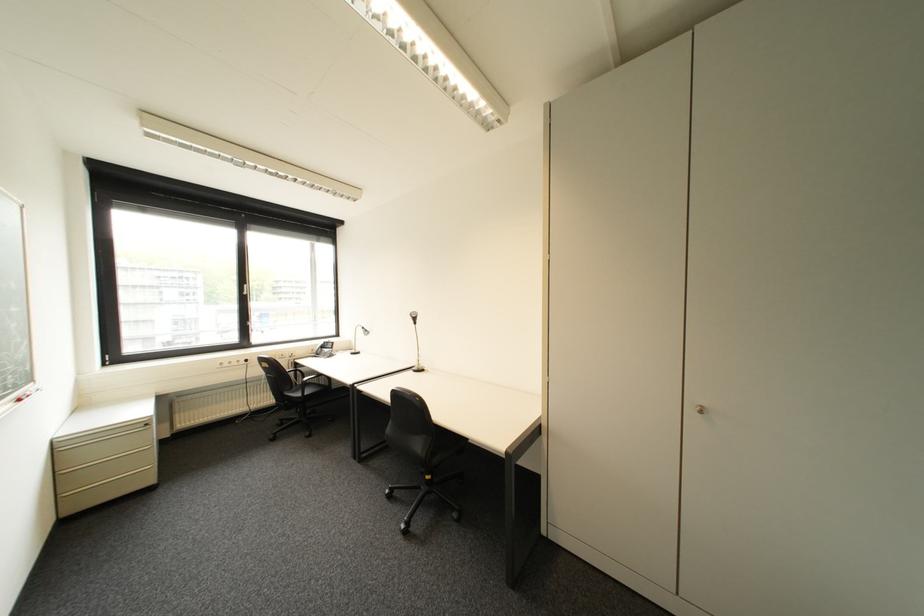
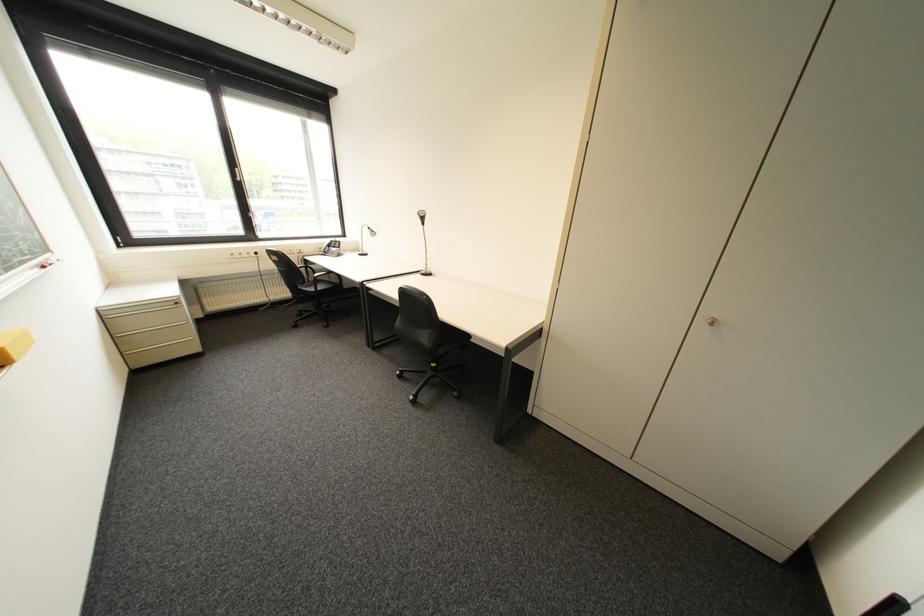
Where in the second image is the point corresponding to (x=423, y=369) from the first image?

(432, 273)